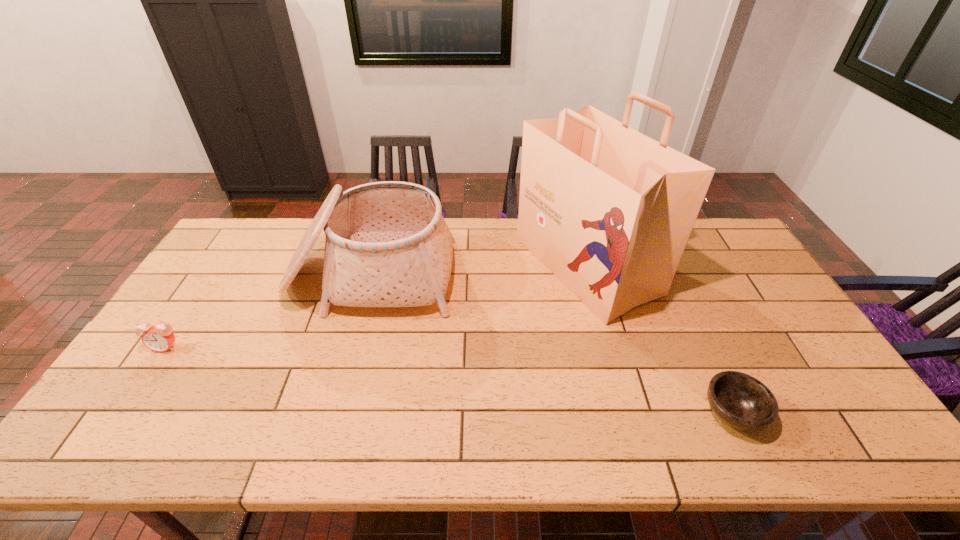
Where is `grocery bag`? grocery bag is located at coordinates point(609,211).

At what (x,y) coordinates should I click in order to perform the action: click on the second object from left to right. Please return your answer as a coordinate pair (x, y). Looking at the image, I should click on (387, 244).

Find the location of `the third shortest object`. the third shortest object is located at coordinates (387, 244).

Locate an element on the screen. This screenshot has height=540, width=960. the third tallest object is located at coordinates (159, 338).

Locate an element on the screen. This screenshot has height=540, width=960. alarm clock is located at coordinates (159, 338).

Locate an element on the screen. The width and height of the screenshot is (960, 540). the nearest object is located at coordinates (741, 401).

Where is `bowl`? bowl is located at coordinates (741, 401).

This screenshot has height=540, width=960. What are the coordinates of `free space located 0.120m on the side of the tallest object with the superhero design` in the screenshot? It's located at (482, 266).

Find the location of a particular element. This screenshot has height=540, width=960. free space located 0.070m on the side of the tallest object with the superhero design is located at coordinates (497, 266).

I want to click on vacant region located on the side of the tallest object with the superhero design, so click(x=479, y=266).